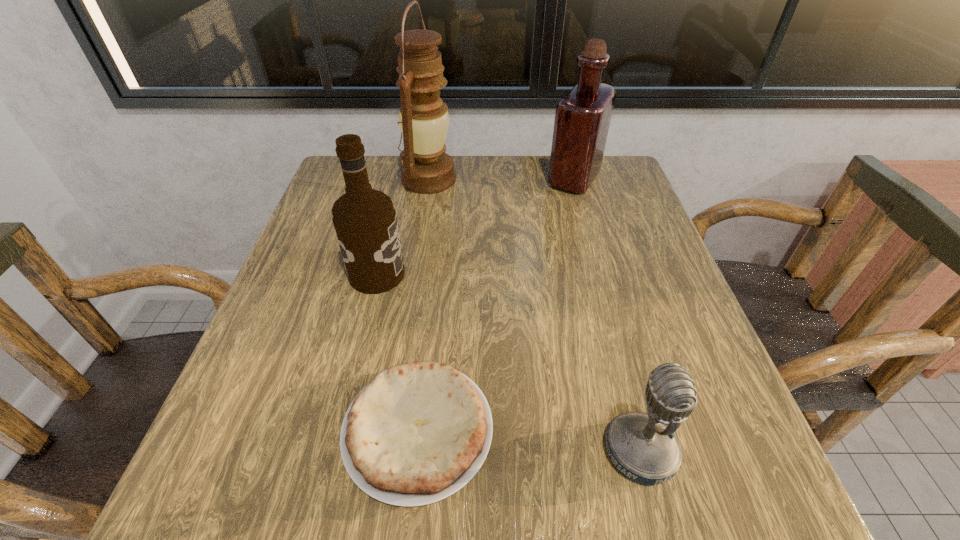
I want to click on free spot located on the front-facing side of the microphone, so click(x=328, y=451).

At what (x,y) coordinates should I click in order to perform the action: click on vacant space located 0.200m on the back of the shortest object. Please return your answer as a coordinate pair (x, y). The height and width of the screenshot is (540, 960). Looking at the image, I should click on (434, 280).

Find the location of a particular element. The width and height of the screenshot is (960, 540). oil lamp that is at the far edge is located at coordinates tap(423, 118).

Image resolution: width=960 pixels, height=540 pixels. I want to click on liquor present at the far edge, so click(x=582, y=119).

Locate an element on the screen. This screenshot has height=540, width=960. microphone that is at the near edge is located at coordinates (643, 447).

Find the location of `tortilla that is at the near edge`. tortilla that is at the near edge is located at coordinates (418, 432).

What are the coordinates of `object that is at the left edge` in the screenshot? It's located at (365, 221).

At what (x,y) coordinates should I click in order to perform the action: click on liquor at the right edge. Please return your answer as a coordinate pair (x, y). This screenshot has height=540, width=960. Looking at the image, I should click on (582, 119).

Locate an element on the screen. Image resolution: width=960 pixels, height=540 pixels. microphone present at the right edge is located at coordinates (643, 447).

Find the location of a particular element. Image resolution: width=960 pixels, height=540 pixels. object that is positioned at the far right corner is located at coordinates (582, 119).